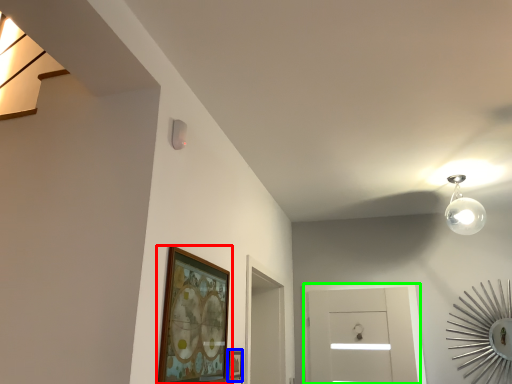
Question: Estimate the real-world distances between objects in this image. Which object is farther from picture frame (highlighted by a red box), picture frame (highlighted by a blue box) or glass door (highlighted by a green box)?

Choices:
 (A) picture frame
 (B) glass door

Answer: (B)